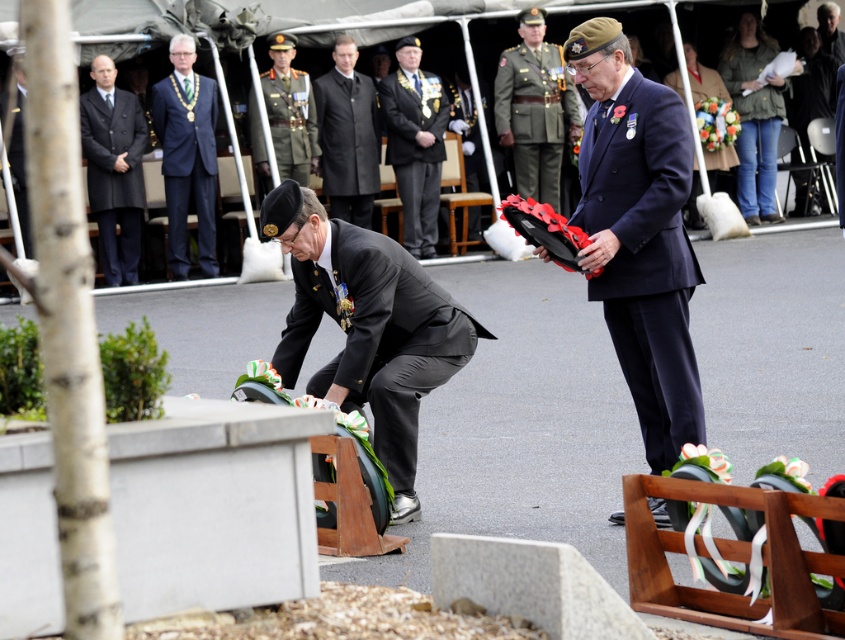
Who is lower down, black fabric suit at lower center or green military uniform at center?

black fabric suit at lower center

Is black fabric suit at lower center bigger than green military uniform at center?

No, black fabric suit at lower center is not bigger than green military uniform at center.

Identify the location of black fabric suit at lower center. This screenshot has width=845, height=640. (377, 337).

I want to click on black fabric suit at lower center, so click(377, 337).

Is the position of green military uniform at center less distant than that of shiny green uniform at center?

That is False.

Measure the distance between green military uniform at center and camera.

A distance of 21.03 meters exists between green military uniform at center and camera.

Is point (543, 108) closer to viewer compared to point (273, 132)?

No, (543, 108) is further to viewer.

Find the location of a particular element. green military uniform at center is located at coordinates (533, 108).

Does black fabric suit at lower center appear on the left side of blue fabric suit at upper center?

Incorrect, black fabric suit at lower center is not on the left side of blue fabric suit at upper center.

Does black fabric suit at lower center appear on the right side of blue fabric suit at upper center?

Correct, you'll find black fabric suit at lower center to the right of blue fabric suit at upper center.

Describe the element at coordinates (377, 337) in the screenshot. I see `black fabric suit at lower center` at that location.

The image size is (845, 640). I want to click on black fabric suit at lower center, so click(x=377, y=337).